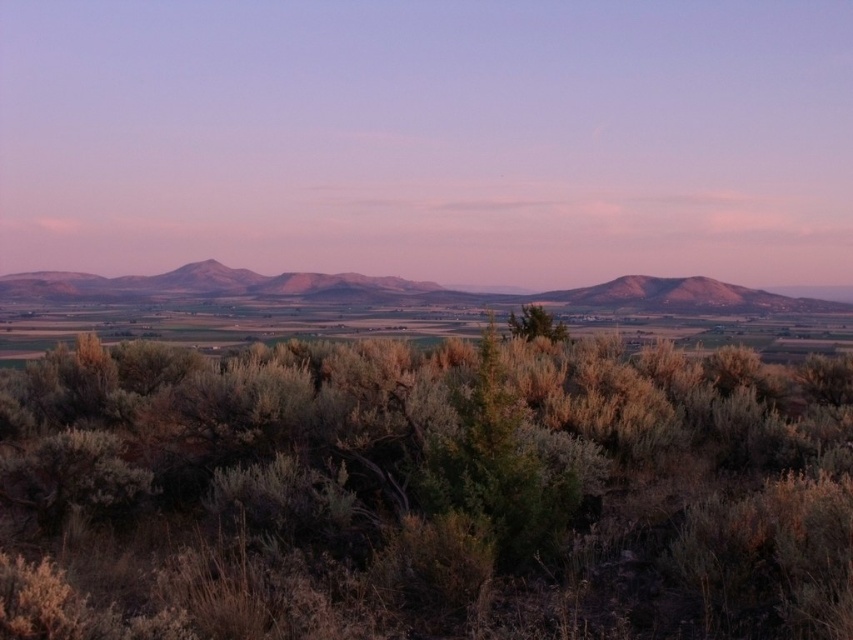
Question: Can you confirm if rustic brown mountains at center is positioned above green leafy bush at center?

Choices:
 (A) no
 (B) yes

Answer: (B)

Question: Can you confirm if rustic brown mountains at center is positioned below green leafy bush at center?

Choices:
 (A) no
 (B) yes

Answer: (A)

Question: Which object is closer to the camera taking this photo?

Choices:
 (A) green leafy bush at center
 (B) green shrubbery at center
 (C) rustic brown mountains at center

Answer: (B)

Question: In this image, where is rustic brown mountains at center located relative to green leafy bush at center?

Choices:
 (A) above
 (B) below

Answer: (A)

Question: Which is nearer to the rustic brown mountains at center?

Choices:
 (A) green leafy bush at center
 (B) green shrubbery at center

Answer: (A)

Question: Which point appears farthest from the camera in this image?

Choices:
 (A) (171, 504)
 (B) (561, 323)

Answer: (B)